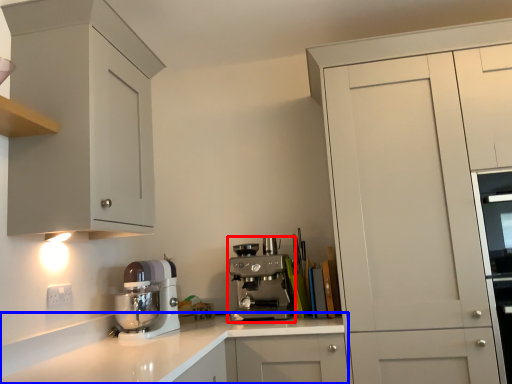
Question: Which object is further to the camera taking this photo, kitchen appliance (highlighted by a red box) or countertop (highlighted by a blue box)?

Choices:
 (A) kitchen appliance
 (B) countertop

Answer: (A)